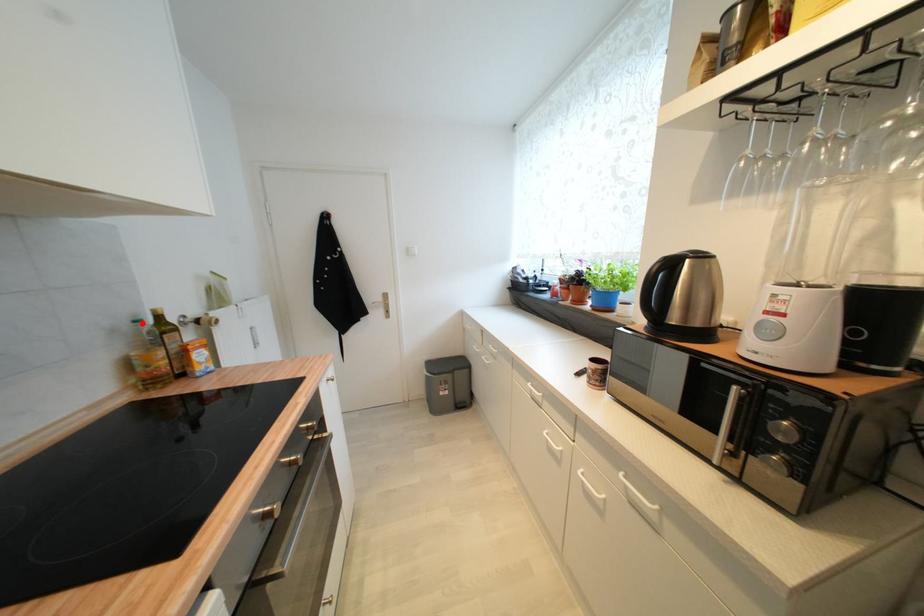
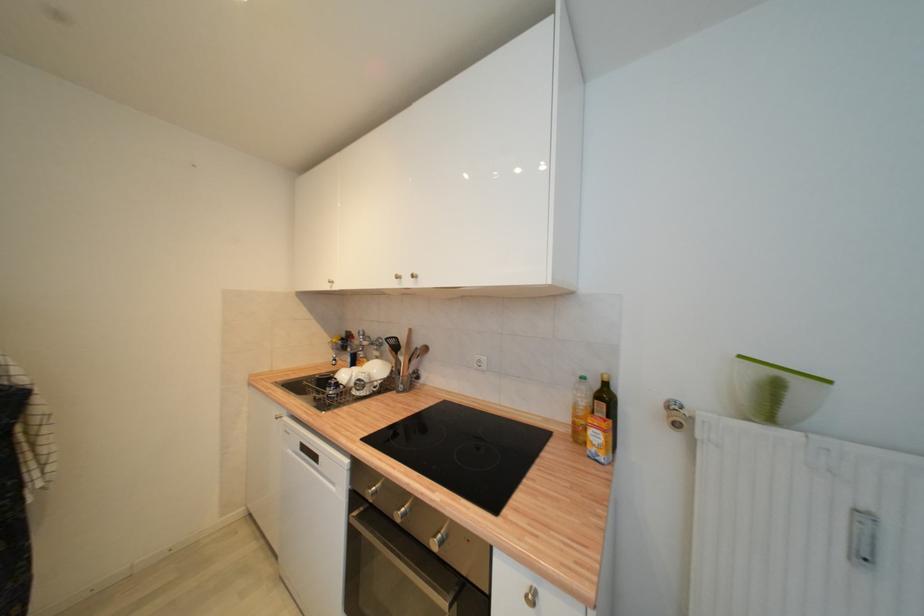
Find the pixel in the second image that matches the highlighted location in the first image.

(586, 379)